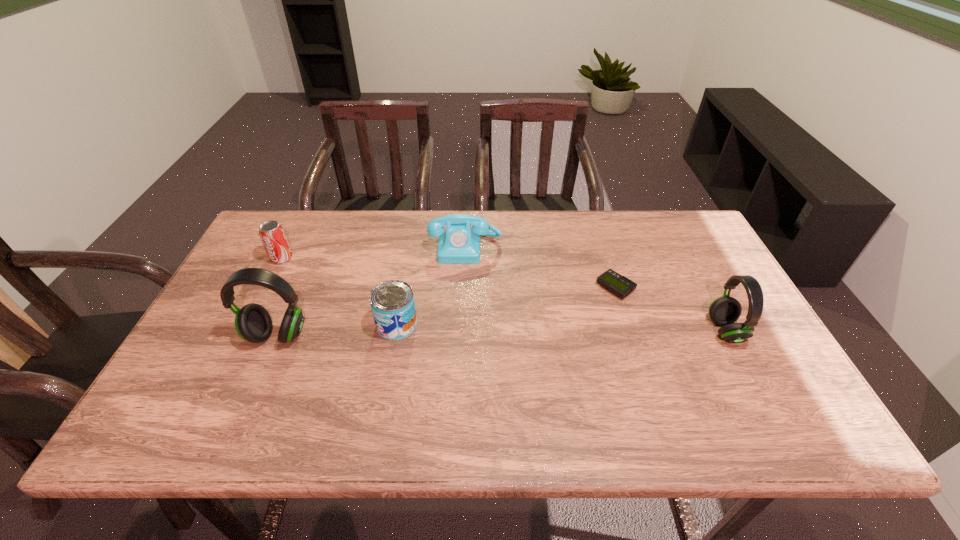
If equal spacing is the goal by inserting an additional headset among them, please point out a vacant space for this new headset. Please provide its 2D coordinates. Your answer should be formatted as a tuple, i.e. [(x, y)], where the tuple contains the x and y coordinates of a point satisfying the conditions above.

[(502, 333)]